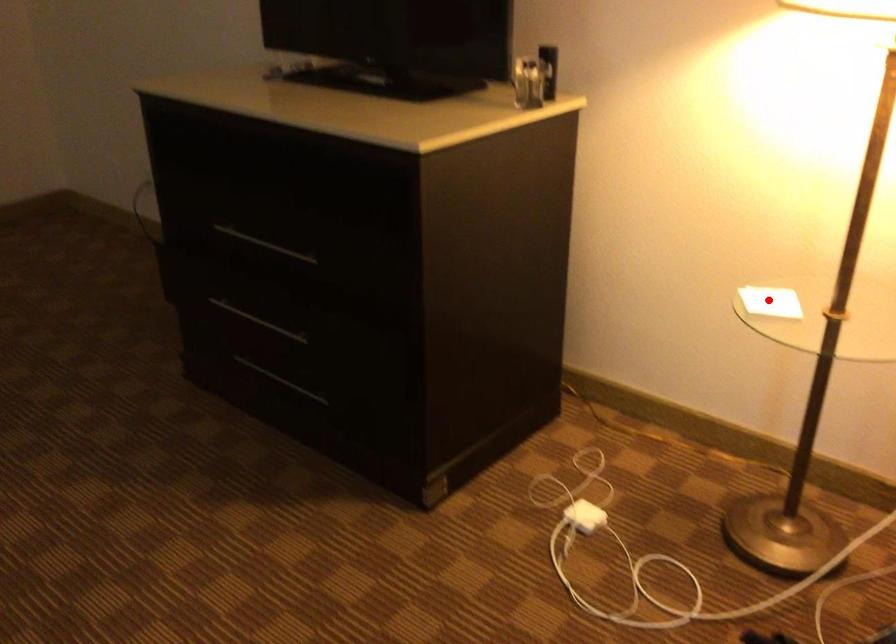
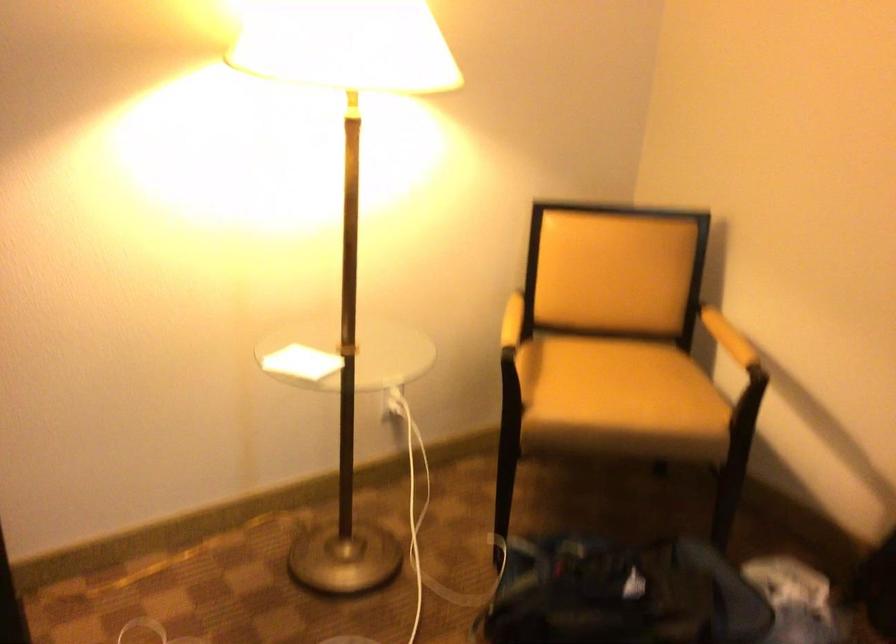
Locate, in the second image, the point that corresponds to the highlighted location in the first image.

(300, 363)